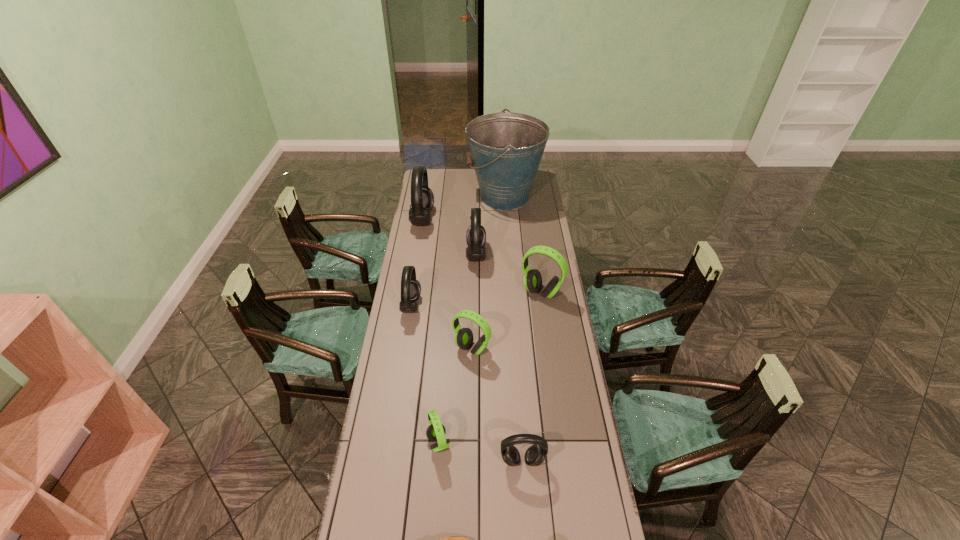
Where is `the tallest object`? the tallest object is located at coordinates (506, 148).

At what (x,y) coordinates should I click in order to perform the action: click on the farthest gray headset. Please return your answer as a coordinate pair (x, y). Looking at the image, I should click on (422, 198).

Find the location of a particular element. The image size is (960, 540). the biggest gray headset is located at coordinates (422, 198).

The height and width of the screenshot is (540, 960). Find the location of `the second farthest gray headset`. the second farthest gray headset is located at coordinates (476, 235).

Identify the location of the second farthest headset. The width and height of the screenshot is (960, 540). (476, 235).

At what (x,y) coordinates should I click in order to perform the action: click on the farthest green headset. Please return your answer as a coordinate pair (x, y). Looking at the image, I should click on (532, 280).

This screenshot has height=540, width=960. I want to click on the biggest green headset, so click(532, 280).

This screenshot has height=540, width=960. In order to click on the third farthest gray headset in this screenshot , I will do `click(410, 287)`.

Where is `the second nearest green headset`? The image size is (960, 540). the second nearest green headset is located at coordinates (464, 337).

You are a GUI agent. You are given a task and a screenshot of the screen. Output one action in this format:
    pyautogui.click(x=<x>, y=<y>)
    Task: Click on the sixth farthest object
    The image size is (960, 540).
    Given the screenshot: What is the action you would take?
    pyautogui.click(x=464, y=337)